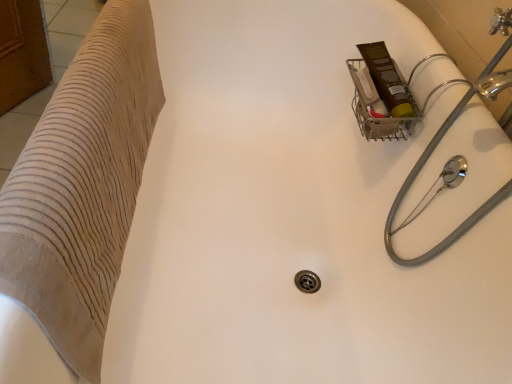
This screenshot has height=384, width=512. Find the location of `gray rubber hose at upper right`. gray rubber hose at upper right is located at coordinates (412, 183).

What do you see at coordinates (412, 183) in the screenshot? I see `gray rubber hose at upper right` at bounding box center [412, 183].

Find the location of a particular element. The height and width of the screenshot is (384, 512). beige textured towel at left is located at coordinates (83, 185).

Describe the element at coordinates (83, 185) in the screenshot. This screenshot has height=384, width=512. I see `beige textured towel at left` at that location.

The width and height of the screenshot is (512, 384). I want to click on gray rubber hose at upper right, so pyautogui.click(x=412, y=183).

Does beige textured towel at left appear on the right side of gray rubber hose at upper right?

Incorrect, beige textured towel at left is not on the right side of gray rubber hose at upper right.

Who is more distant, beige textured towel at left or gray rubber hose at upper right?

Positioned behind is gray rubber hose at upper right.

Considering the positions of point (142, 95) and point (454, 237), is point (142, 95) closer or farther from the camera than point (454, 237)?

Point (142, 95) is farther from the camera than point (454, 237).

From the image's perspective, is beige textured towel at left over gray rubber hose at upper right?

Yes, from the image's perspective, beige textured towel at left is over gray rubber hose at upper right.

From a real-world perspective, is beige textured towel at left over gray rubber hose at upper right?

No.

Is beige textured towel at left wider than gray rubber hose at upper right?

In fact, beige textured towel at left might be narrower than gray rubber hose at upper right.

Does beige textured towel at left have a greater height compared to gray rubber hose at upper right?

No, beige textured towel at left is not taller than gray rubber hose at upper right.

Who is bigger, beige textured towel at left or gray rubber hose at upper right?

Bigger between the two is gray rubber hose at upper right.

Do you think beige textured towel at left is within gray rubber hose at upper right, or outside of it?

beige textured towel at left is located beyond the bounds of gray rubber hose at upper right.

From the picture: Is beige textured towel at left touching gray rubber hose at upper right?

No, beige textured towel at left is not beside gray rubber hose at upper right.

Is beige textured towel at left oriented towards gray rubber hose at upper right?

No, beige textured towel at left does not turn towards gray rubber hose at upper right.

How many degrees apart are the facing directions of beige textured towel at left and gray rubber hose at upper right?

They differ by 1.79 degrees in their facing directions.

Image resolution: width=512 pixels, height=384 pixels. In order to click on furniture that appears in front of the gray rubber hose at upper right in this screenshot , I will do `click(83, 185)`.

Which is more to the left, gray rubber hose at upper right or beige textured towel at left?

From the viewer's perspective, beige textured towel at left appears more on the left side.

In the scene shown: Is gray rubber hose at upper right in front of or behind beige textured towel at left in the image?

gray rubber hose at upper right is positioned farther from the viewer than beige textured towel at left.

Is point (407, 186) farther from camera compared to point (82, 47)?

Yes.

From the image's perspective, does gray rubber hose at upper right appear lower than beige textured towel at left?

Correct, gray rubber hose at upper right appears lower than beige textured towel at left in the image.

From a real-world perspective, relative to beige textured towel at left, is gray rubber hose at upper right vertically above or below?

gray rubber hose at upper right is above beige textured towel at left.

Which of these two, gray rubber hose at upper right or beige textured towel at left, is wider?

Wider between the two is gray rubber hose at upper right.

Is gray rubber hose at upper right taller than beige textured towel at left?

Correct, gray rubber hose at upper right is much taller as beige textured towel at left.

Considering the relative sizes of gray rubber hose at upper right and beige textured towel at left in the image provided, is gray rubber hose at upper right smaller than beige textured towel at left?

No, gray rubber hose at upper right is not smaller than beige textured towel at left.

Do you think gray rubber hose at upper right is within beige textured towel at left, or outside of it?

gray rubber hose at upper right is spatially situated outside beige textured towel at left.

Is gray rubber hose at upper right far from beige textured towel at left?

No, gray rubber hose at upper right is not far away from beige textured towel at left.

Is gray rubber hose at upper right aimed at beige textured towel at left?

Yes.

How different are the orientations of gray rubber hose at upper right and beige textured towel at left in degrees?

The angular difference between gray rubber hose at upper right and beige textured towel at left is 1.79 degrees.

Based on the photo, how far apart are gray rubber hose at upper right and beige textured towel at left?

They are 25.17 inches apart.

What are the coordinates of `water pipe below the beige textured towel at left (from the image's perspective)` in the screenshot? It's located at (412, 183).

You are a GUI agent. You are given a task and a screenshot of the screen. Output one action in this format:
    pyautogui.click(x=<x>, y=<y>)
    Task: Click on the furniture above the gray rubber hose at upper right (from the image's perspective)
    Image resolution: width=512 pixels, height=384 pixels.
    Given the screenshot: What is the action you would take?
    pyautogui.click(x=83, y=185)

At what (x,y) coordinates should I click in order to perform the action: click on furniture beneath the gray rubber hose at upper right (from a real-world perspective). Please return your answer as a coordinate pair (x, y). This screenshot has width=512, height=384. Looking at the image, I should click on (83, 185).